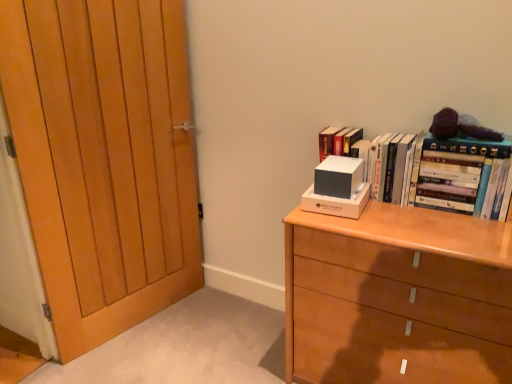
The width and height of the screenshot is (512, 384). In order to click on free space in front of wooden door at left in this screenshot , I will do `click(133, 352)`.